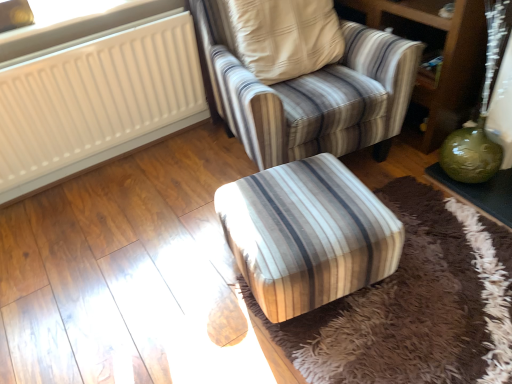
The width and height of the screenshot is (512, 384). I want to click on free space between striped fabric ottoman at center and green glossy vase at right, so click(426, 220).